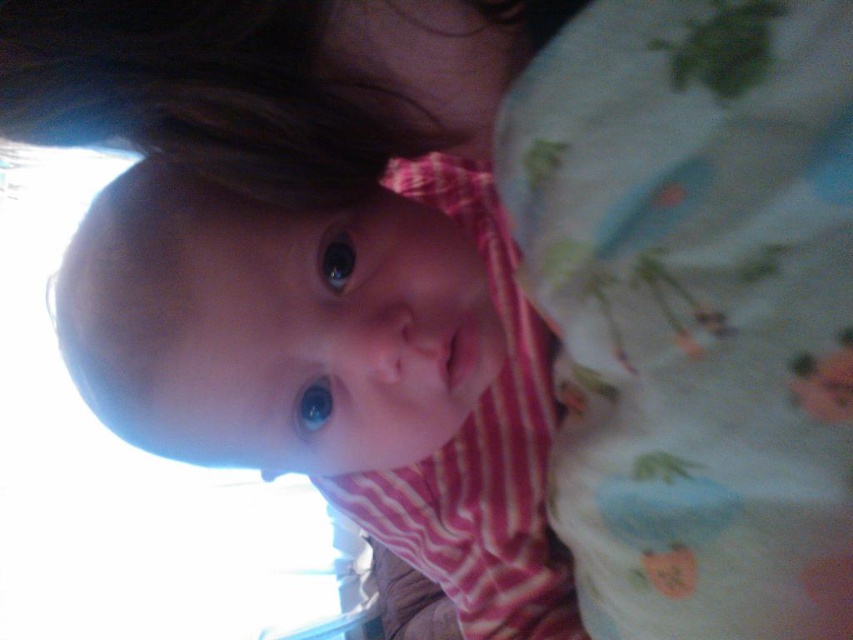
Looking at this image, does light blue cotton blanket at upper right appear on the left side of pink striped shirt at center?

In fact, light blue cotton blanket at upper right is to the right of pink striped shirt at center.

How far apart are light blue cotton blanket at upper right and pink striped shirt at center?

light blue cotton blanket at upper right is 4.85 inches away from pink striped shirt at center.

The image size is (853, 640). What do you see at coordinates (695, 308) in the screenshot?
I see `light blue cotton blanket at upper right` at bounding box center [695, 308].

Locate an element on the screen. Image resolution: width=853 pixels, height=640 pixels. light blue cotton blanket at upper right is located at coordinates (695, 308).